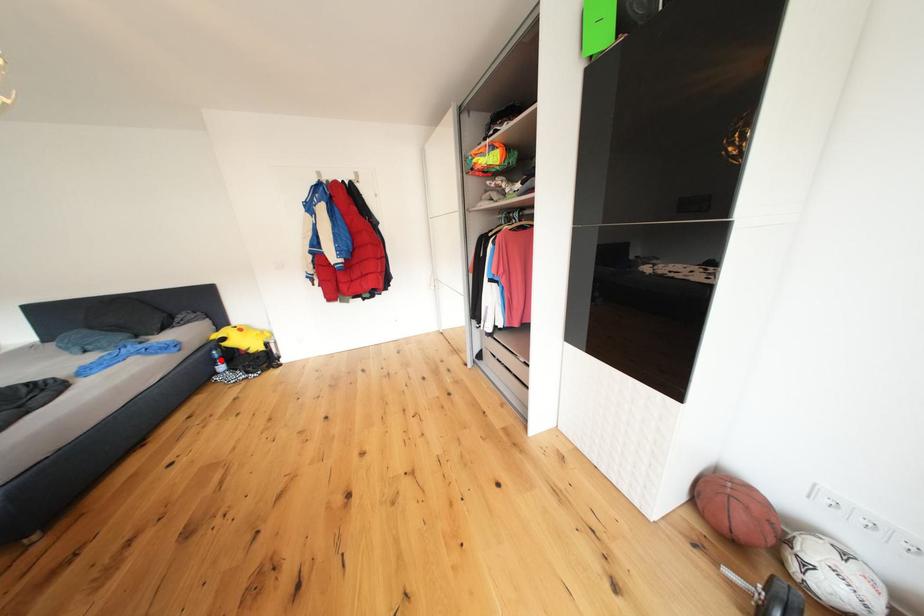
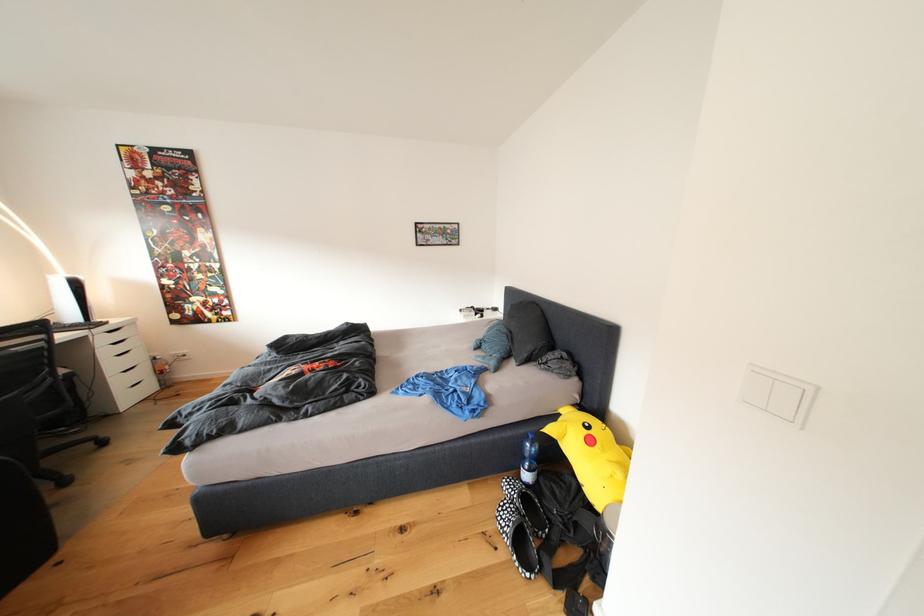
Where in the second image is the point corresponding to the highlighted location from the first image?

(531, 451)